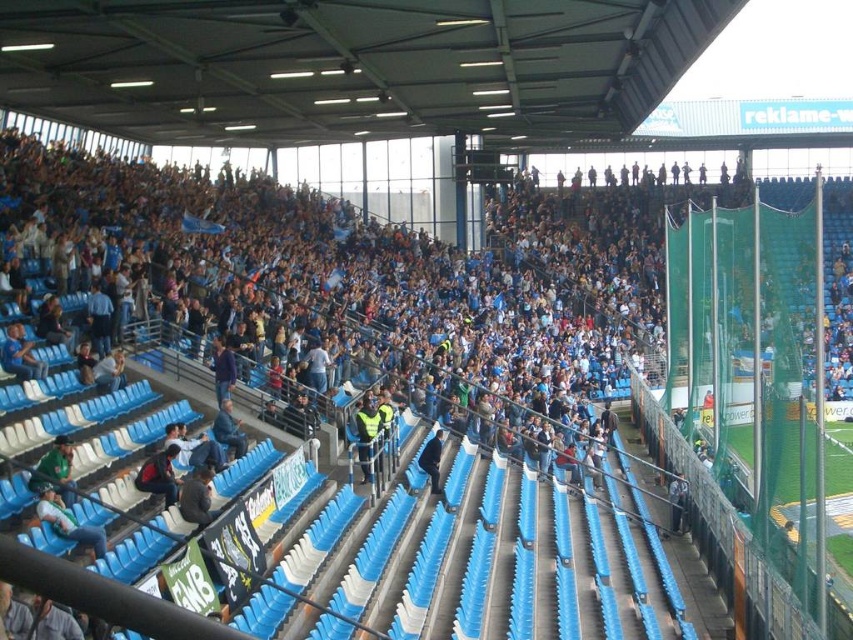
Consider the image. You are a photographer at the stadium and want to capture a clear photo of the yellow reflective vest at center and the dark blue fabric jacket at center. Which object should you zoom in on to ensure it appears bigger in your photo?

The yellow reflective vest at center is larger in size than the dark blue fabric jacket at center, so you should zoom in on the yellow reflective vest at center to make it appear bigger in the photo.

You are standing at the center of the stadium and want to find the light blue plastic seat at lower left. According to the coordinates provided, in which direction should you move to reach it?

The light blue plastic seat at lower left is located at coordinates 0.816 on the x axis and 0.081 on the y axis. Since the y coordinate is very low, you should move downward from the center to reach it.

You are a photographer standing at the back of the stadium. You want to take a photo of the yellow reflective vest at center and the dark blue fabric jacket at center. Which object will appear taller in the photo?

The yellow reflective vest at center will appear taller in the photo because it has a greater height compared to the dark blue fabric jacket at center.